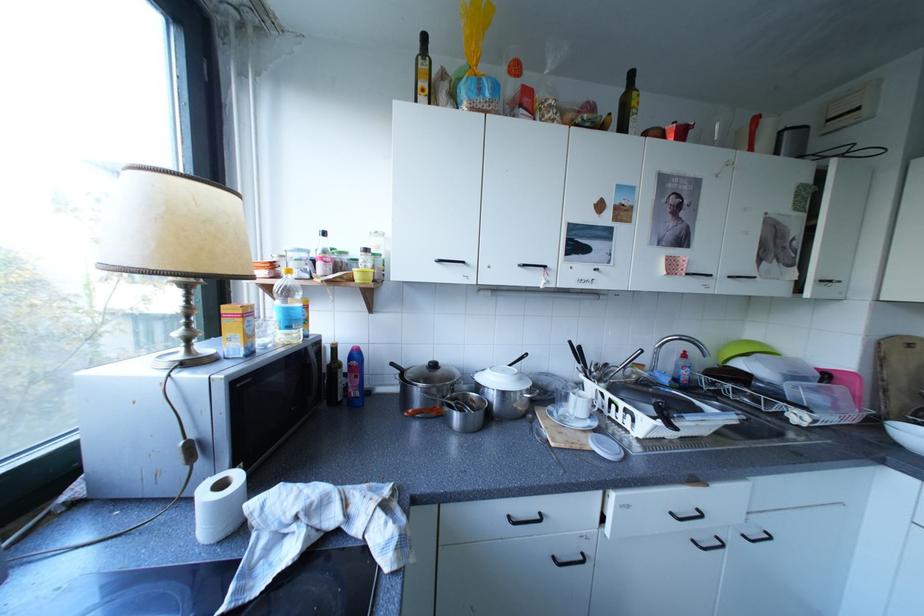
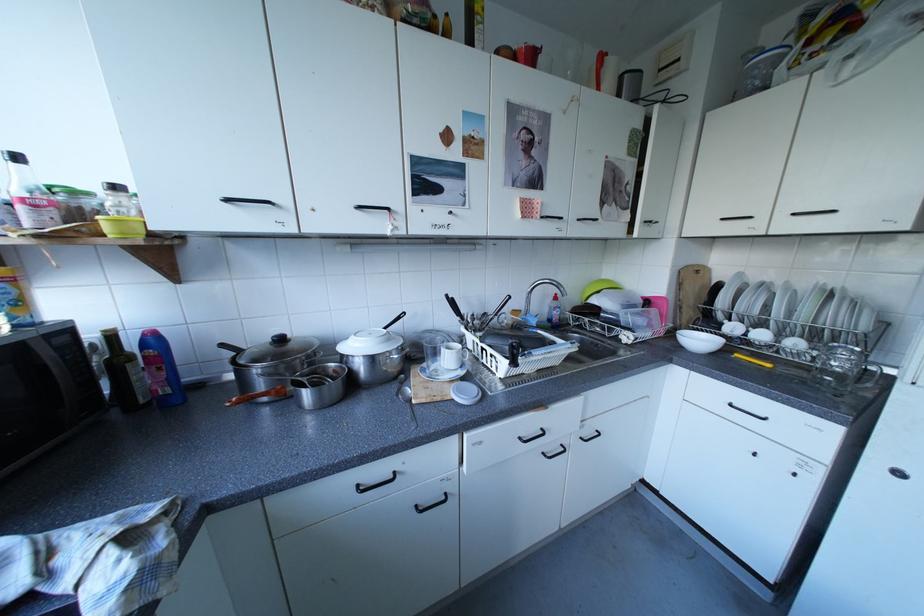
Where in the second image is the point corresponding to point (707, 541) from the first image?

(555, 454)